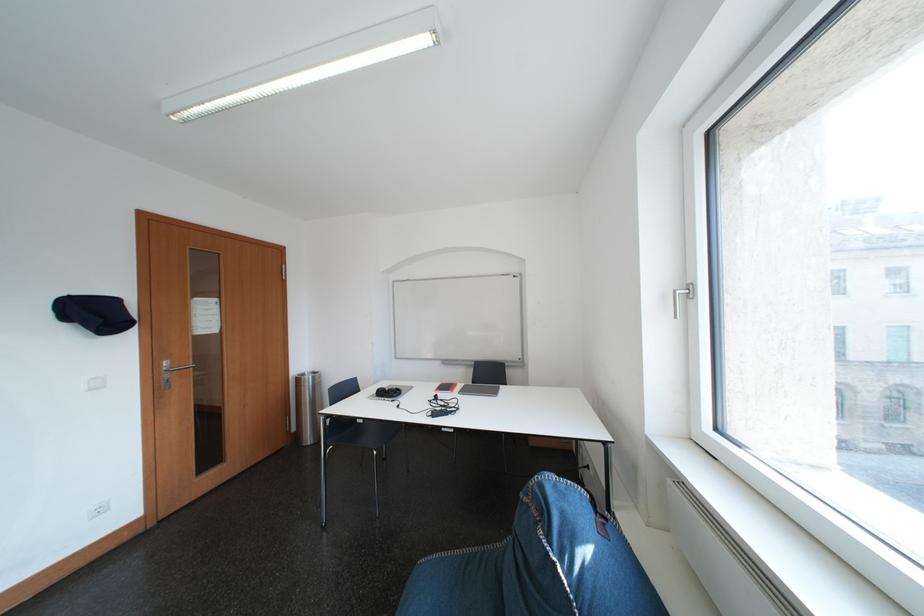
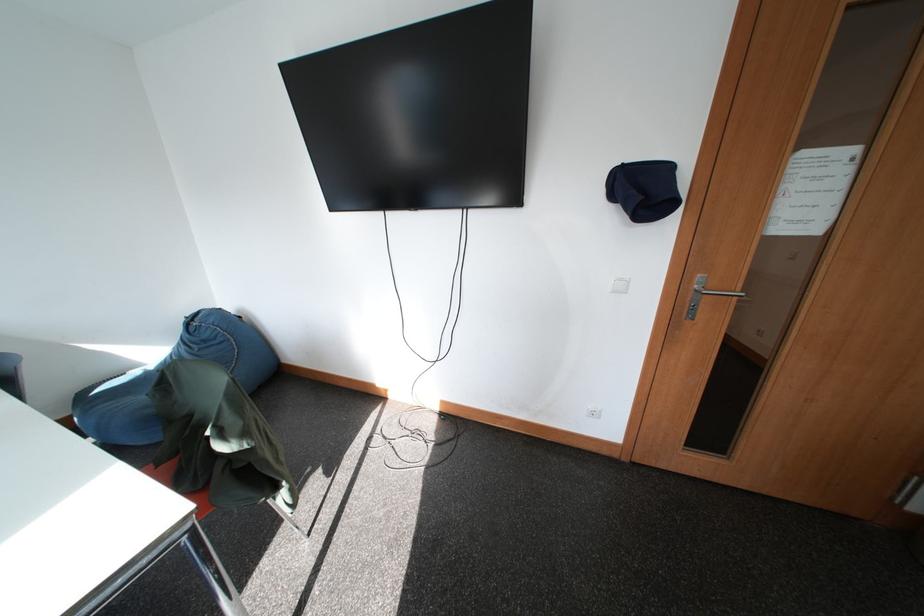
Where in the second image is the point corresponding to the point at 172,368 from the first image?

(703, 282)